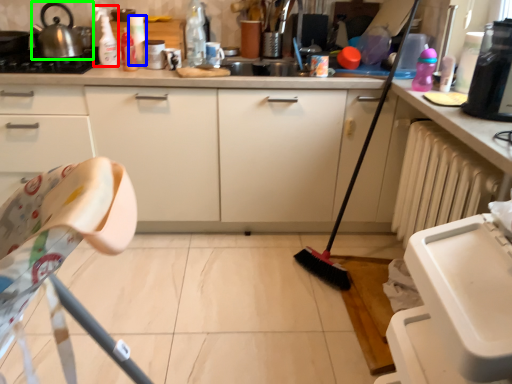
Question: Which object is positioned closest to cleaning product (highlighted by a red box)? Select from bottle (highlighted by a blue box) and tea pot (highlighted by a green box).

Choices:
 (A) bottle
 (B) tea pot

Answer: (B)